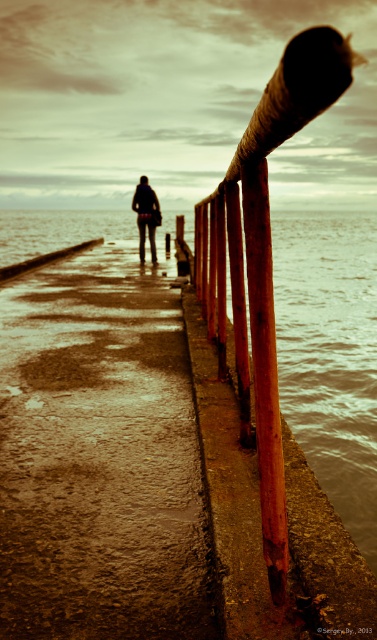
Can you confirm if rusty metal water at right is positioned to the left of dark gray fabric jacket at center?

Incorrect, rusty metal water at right is not on the left side of dark gray fabric jacket at center.

Does rusty metal water at right appear over dark gray fabric jacket at center?

Indeed, rusty metal water at right is positioned over dark gray fabric jacket at center.

This screenshot has height=640, width=377. Describe the element at coordinates (331, 353) in the screenshot. I see `rusty metal water at right` at that location.

This screenshot has height=640, width=377. What are the coordinates of `rusty metal water at right` in the screenshot? It's located at (331, 353).

In the scene shown: Does rusty metal water at right appear on the right side of rusty metal pole at center?

Indeed, rusty metal water at right is positioned on the right side of rusty metal pole at center.

Find the location of a particular element. rusty metal water at right is located at coordinates (331, 353).

Is point (337, 280) farther from camera compared to point (274, 339)?

Yes, point (337, 280) is behind point (274, 339).

Identify the location of rusty metal water at right. The width and height of the screenshot is (377, 640). (331, 353).

Who is positioned more to the right, rusty metal pole at center or dark gray fabric jacket at center?

rusty metal pole at center is more to the right.

The image size is (377, 640). What do you see at coordinates (265, 372) in the screenshot?
I see `rusty metal pole at center` at bounding box center [265, 372].

The image size is (377, 640). In order to click on rusty metal pole at center in this screenshot , I will do `click(265, 372)`.